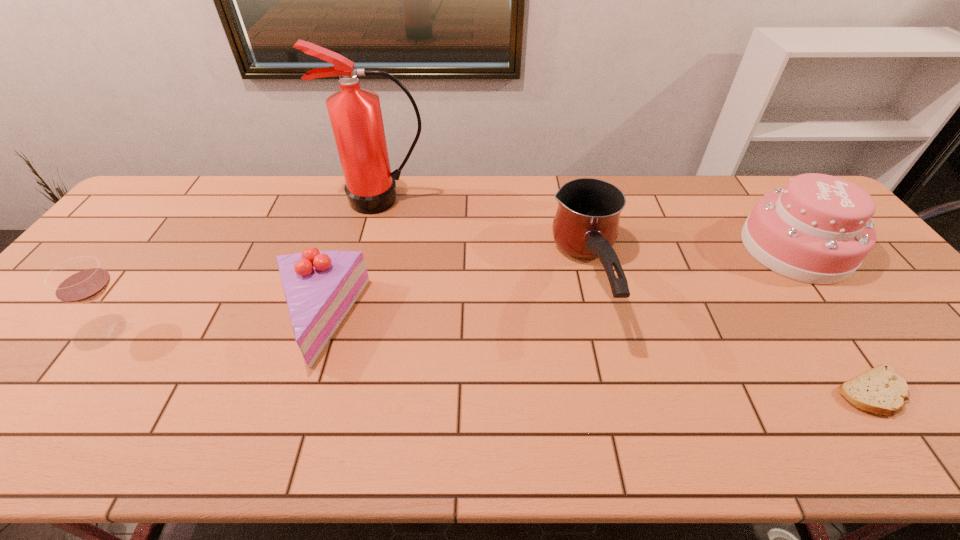
Find the location of `vacant space located 0.050m on the handle side of the saucepan`. vacant space located 0.050m on the handle side of the saucepan is located at coordinates (609, 364).

Image resolution: width=960 pixels, height=540 pixels. In order to click on vacant region located 0.170m on the left of the leftmost object in this screenshot , I will do `click(31, 325)`.

The height and width of the screenshot is (540, 960). Find the location of `free space located on the back of the left cake`. free space located on the back of the left cake is located at coordinates (343, 241).

Locate an element on the screen. This screenshot has width=960, height=540. free spot located on the back of the pita bread is located at coordinates (822, 320).

Locate an element on the screen. fire extinguisher present at the far edge is located at coordinates (355, 114).

Identify the location of cake that is positioned at the far edge. This screenshot has width=960, height=540. (817, 230).

This screenshot has width=960, height=540. I want to click on object that is at the near edge, so click(880, 390).

Locate an element on the screen. object that is positioned at the right edge is located at coordinates (817, 230).

The width and height of the screenshot is (960, 540). I want to click on object at the far right corner, so click(817, 230).

You are a GUI agent. You are given a task and a screenshot of the screen. Output one action in this format:
    pyautogui.click(x=<x>, y=<y>)
    Task: Click on the vacant region at the far edge
    
    Given the screenshot: What is the action you would take?
    pyautogui.click(x=721, y=180)